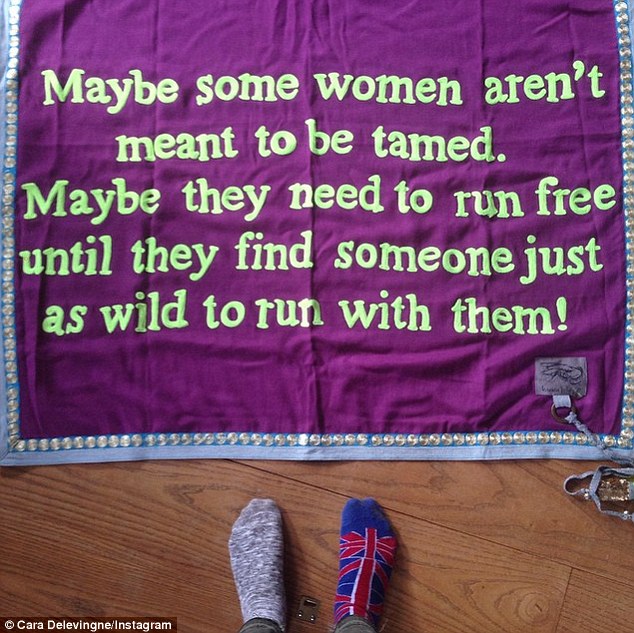
You are a GUI agent. You are given a task and a screenshot of the screen. Output one action in this format:
    pyautogui.click(x=<x>, y=<y>)
    Task: Click on the blue blankey border
    Image resolution: width=634 pixels, height=633 pixels.
    Given the screenshot: What is the action you would take?
    pyautogui.click(x=316, y=452)